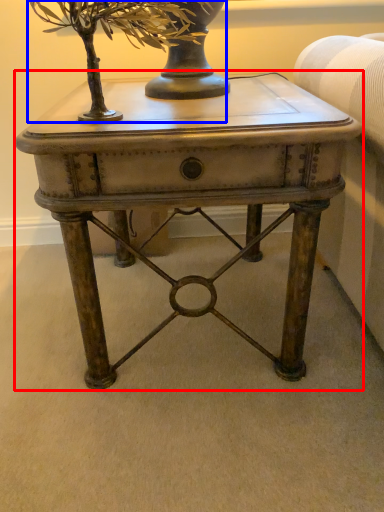
Question: Which of the following is the farthest to the observer, table (highlighted by a red box) or tree (highlighted by a blue box)?

Choices:
 (A) table
 (B) tree

Answer: (A)